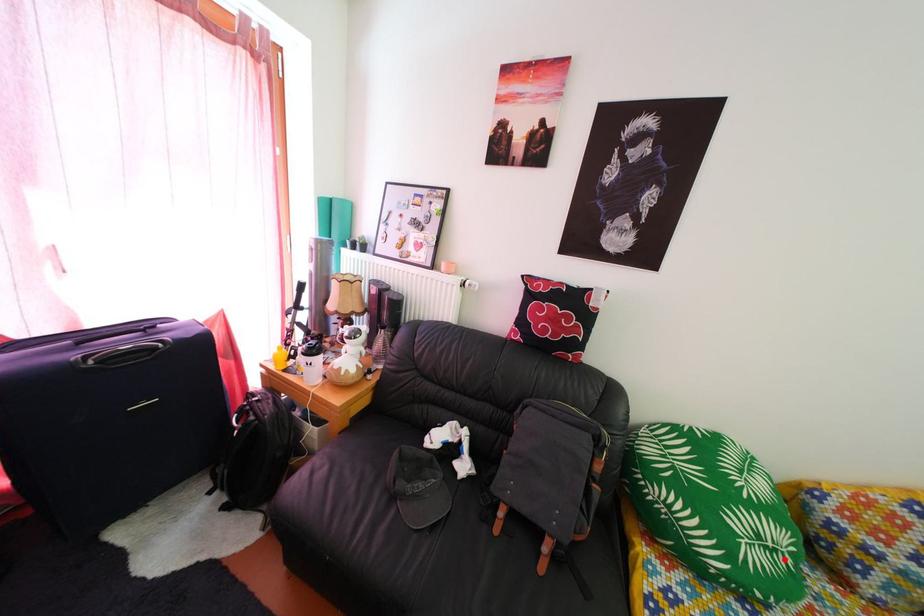
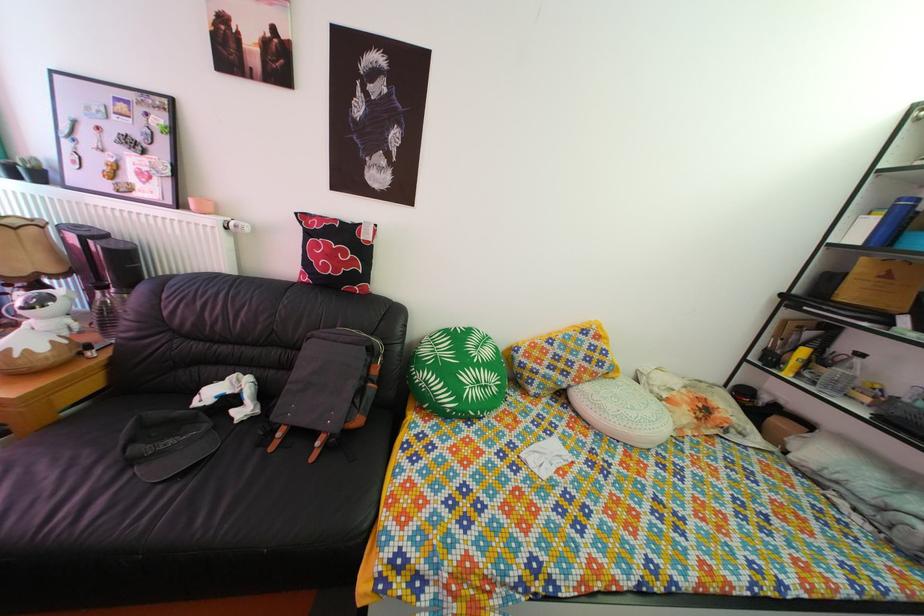
Find the pixel in the second image that matches the highlighted location in the first image.

(494, 395)